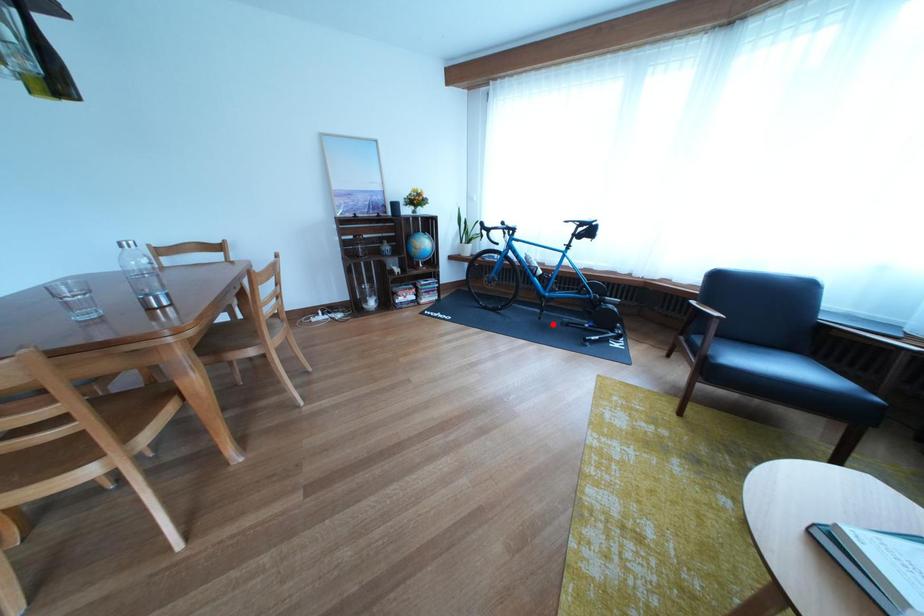
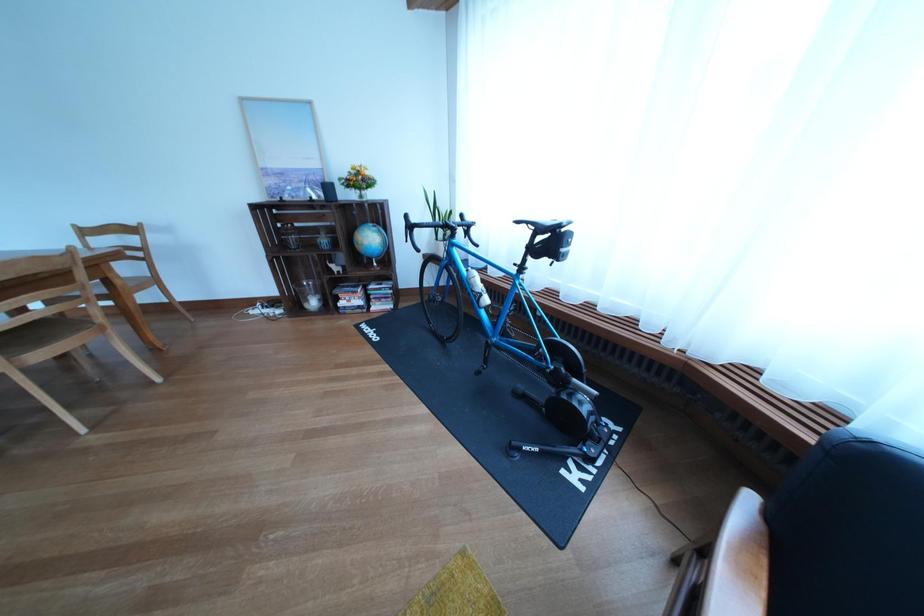
The point at the highlighted location is marked in the first image. Where is the corresponding point in the second image?

(492, 379)